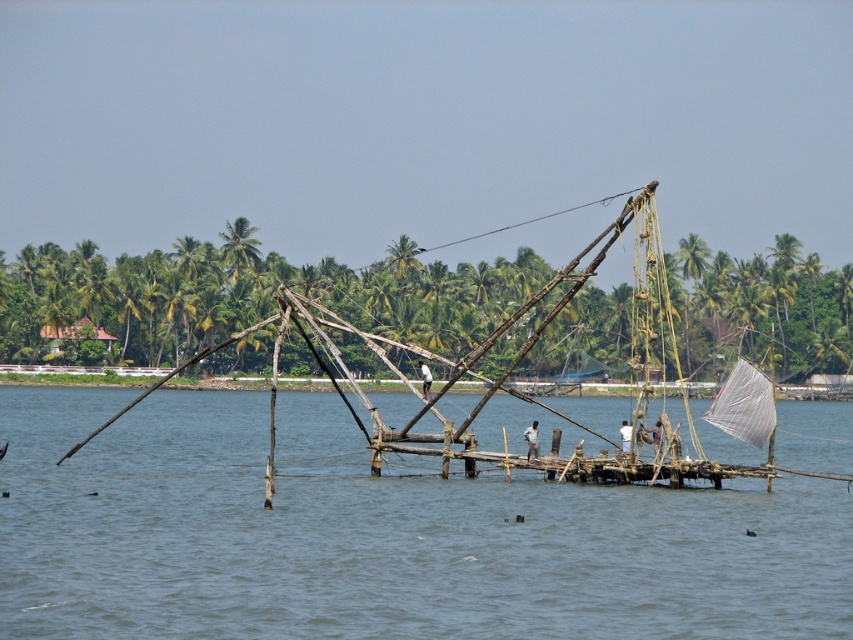
Which is more to the left, wooden boat at center or light brown wooden pole at center?

Positioned to the left is wooden boat at center.

Who is positioned more to the right, wooden boat at center or light brown wooden pole at center?

light brown wooden pole at center is more to the right.

This screenshot has height=640, width=853. Describe the element at coordinates (430, 321) in the screenshot. I see `wooden boat at center` at that location.

Locate an element on the screen. The height and width of the screenshot is (640, 853). wooden boat at center is located at coordinates (430, 321).

Is transparent water at center shorter than wooden boat at center?

Yes, transparent water at center is shorter than wooden boat at center.

Is transparent water at center positioned behind wooden boat at center?

No, it is in front of wooden boat at center.

Between point (201, 400) and point (747, 262), which one is positioned behind?

The point (747, 262) is more distant.

At what (x,y) coordinates should I click in order to perform the action: click on transparent water at center. Please return your answer as a coordinate pair (x, y). The image size is (853, 640). Looking at the image, I should click on (379, 536).

The image size is (853, 640). Identify the location of transparent water at center. point(379,536).

Who is more distant from viewer, (364, 538) or (421, 376)?

The point (421, 376) is more distant.

Does point (286, 456) come in front of point (421, 364)?

Yes, point (286, 456) is in front of point (421, 364).

Locate an element on the screen. The height and width of the screenshot is (640, 853). transparent water at center is located at coordinates (379, 536).